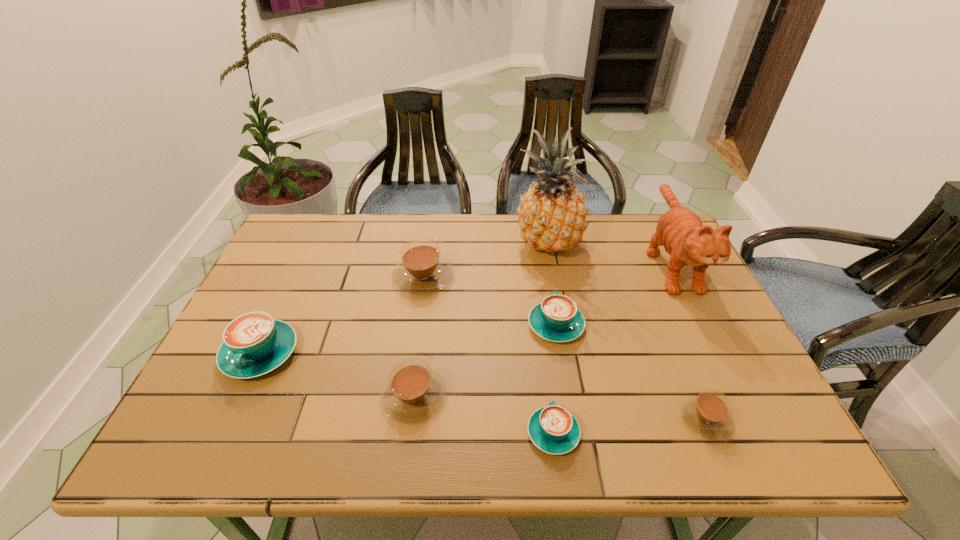
The width and height of the screenshot is (960, 540). I want to click on cappuccino that is at the right edge, so click(708, 414).

I want to click on object located at the far right corner, so click(686, 240).

Find the location of a particular element. object situated at the near right corner is located at coordinates (708, 414).

This screenshot has height=540, width=960. In the image, there is a desktop. In order to click on vacant space at the far edge in this screenshot , I will do `click(587, 240)`.

Image resolution: width=960 pixels, height=540 pixels. I want to click on vacant region at the near edge of the desktop, so click(441, 445).

This screenshot has height=540, width=960. In order to click on vacant space at the left edge in this screenshot , I will do `click(190, 404)`.

In the image, there is a desktop. Identify the location of vacant space at the right edge. The height and width of the screenshot is (540, 960). (746, 413).

This screenshot has width=960, height=540. What are the coordinates of `vacant space at the near right corner of the desktop` in the screenshot? It's located at (768, 418).

Identify the location of free space between the second biggest turquoise cappuccino and the cat. (613, 294).

Where is `free space that is in between the nearest turquoise cappuccino and the rightmost brown cappuccino`? Image resolution: width=960 pixels, height=540 pixels. free space that is in between the nearest turquoise cappuccino and the rightmost brown cappuccino is located at coordinates (629, 426).